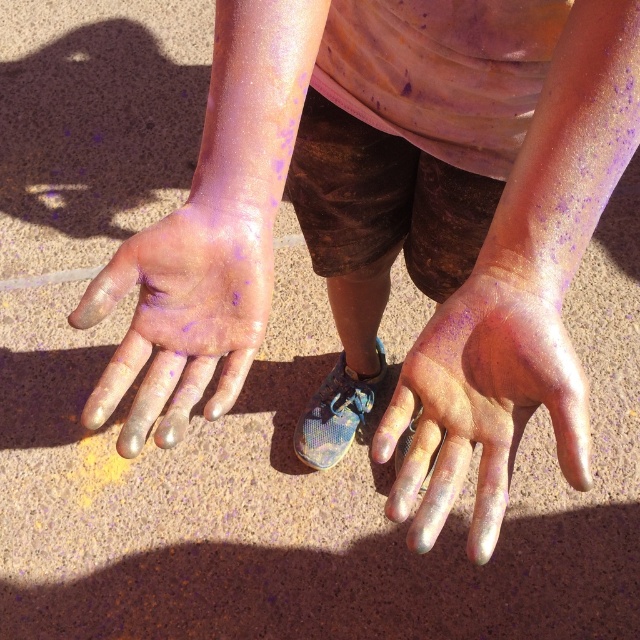
Is iridescent metallic hand at center wider than shiny metallic hand at center?

No, iridescent metallic hand at center is not wider than shiny metallic hand at center.

Is point (456, 497) in front of point (184, 336)?

Yes, it is in front of point (184, 336).

Who is more distant from viewer, (490, 355) or (92, 424)?

The point (92, 424) is more distant.

Find the location of `iridescent metallic hand at center`. iridescent metallic hand at center is located at coordinates (483, 403).